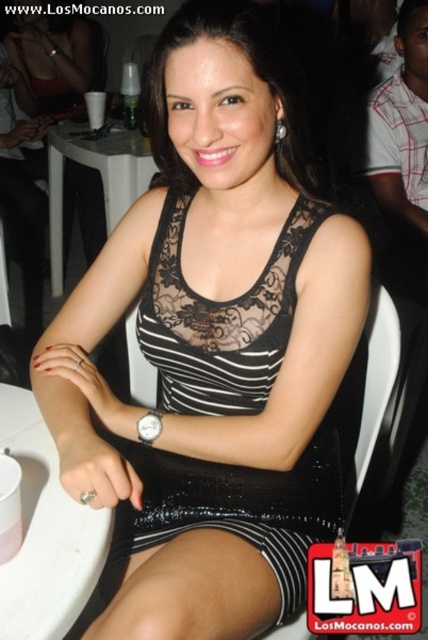
Is the position of black sequined dress at center less distant than that of white plastic table at lower left?

Result: No, it is behind white plastic table at lower left.

Does black sequined dress at center have a smaller size compared to white plastic table at lower left?

No, black sequined dress at center is not smaller than white plastic table at lower left.

Locate an element on the screen. The image size is (428, 640). black sequined dress at center is located at coordinates (219, 320).

Between white plastic table at lower left and white plastic table at center, which one appears on the left side from the viewer's perspective?

Positioned to the left is white plastic table at center.

Between point (104, 522) and point (121, 204), which one is positioned in front?

Point (104, 522) is in front.

What do you see at coordinates (45, 532) in the screenshot?
I see `white plastic table at lower left` at bounding box center [45, 532].

At what (x,y) coordinates should I click in order to perform the action: click on white plastic table at lower left. Please return your answer as a coordinate pair (x, y). Looking at the image, I should click on (45, 532).

Between black sequined dress at center and white plastic table at center, which one appears on the right side from the viewer's perspective?

Positioned to the right is black sequined dress at center.

Describe the element at coordinates (219, 320) in the screenshot. The image size is (428, 640). I see `black sequined dress at center` at that location.

Find the location of a particular element. black sequined dress at center is located at coordinates (219, 320).

You are a GUI agent. You are given a task and a screenshot of the screen. Output one action in this format:
    pyautogui.click(x=<x>, y=<y>)
    Task: Click on the black sequined dress at center
    
    Given the screenshot: What is the action you would take?
    pyautogui.click(x=219, y=320)